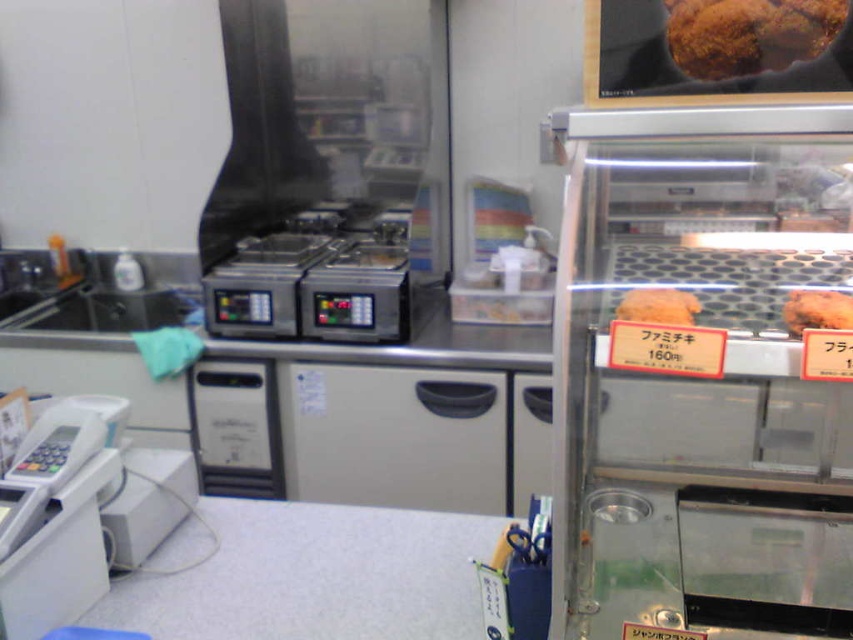
Question: Where is metallic glass display case at right located in relation to brown matte bread at upper right in the image?

Choices:
 (A) above
 (B) below

Answer: (A)

Question: From the image, what is the correct spatial relationship of white laminate counter at lower center in relation to metallic silver appliance at center?

Choices:
 (A) right
 (B) left

Answer: (A)

Question: Which point is closer to the camera?

Choices:
 (A) white laminate counter at lower center
 (B) metallic silver deep fryer at center
 (C) brown matte bread at upper right

Answer: (C)

Question: Which of the following is the farthest from the observer?

Choices:
 (A) (627, 296)
 (B) (265, 387)

Answer: (B)

Question: Which object is the farthest from the brown matte bread at upper right?

Choices:
 (A) white laminate counter at lower center
 (B) golden crispy bread at center

Answer: (A)

Question: In this image, where is silver metallic vending machine at center located relative to brown matte bread at upper right?

Choices:
 (A) above
 (B) below

Answer: (B)